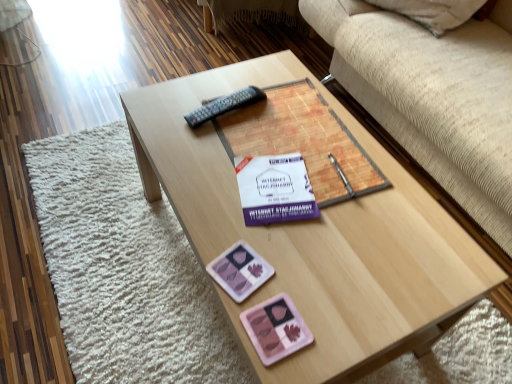
You are a GUI agent. You are given a task and a screenshot of the screen. Output one action in this format:
    pyautogui.click(x=<x>, y=<y>)
    Task: Click on the vacant region in front of white paper at center
    
    Given the screenshot: What is the action you would take?
    pyautogui.click(x=287, y=257)